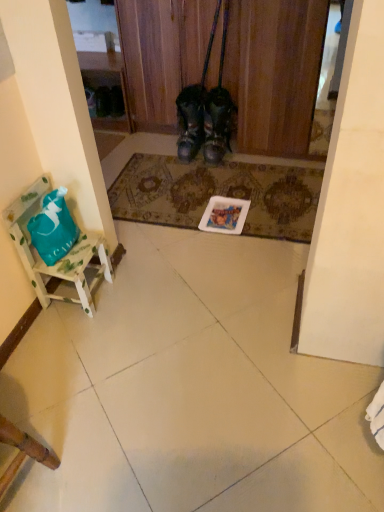
Find the location of `free space underneath wooden chair at lower left (from a real-world perspective)`. free space underneath wooden chair at lower left (from a real-world perspective) is located at coordinates (28, 484).